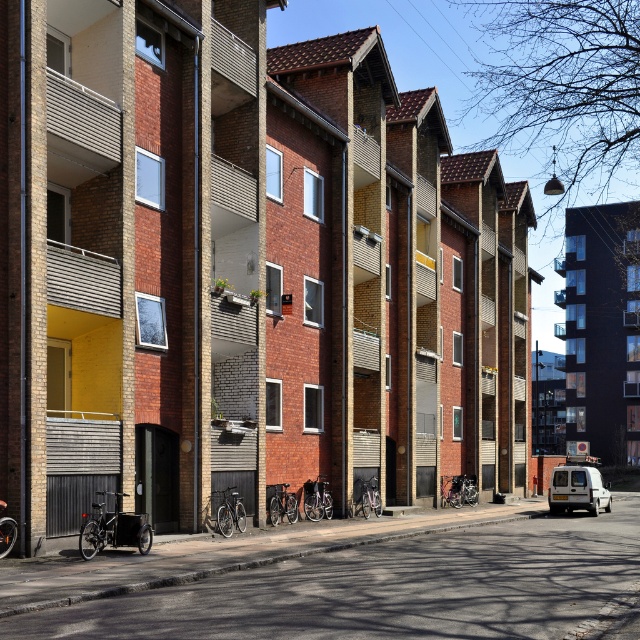
Question: Can you confirm if black metal bicycles at lower left is positioned to the left of white matte van at lower right?

Choices:
 (A) no
 (B) yes

Answer: (B)

Question: Which of the following is the farthest from the observer?

Choices:
 (A) black metal bicycles at lower left
 (B) white matte van at lower right

Answer: (B)

Question: Which point appears closest to the camera in this image?

Choices:
 (A) (426, 536)
 (B) (561, 486)

Answer: (A)

Question: Is black metal bicycles at lower left above white matte van at lower right?

Choices:
 (A) yes
 (B) no

Answer: (A)

Question: Does black metal bicycles at lower left have a lesser width compared to white matte van at lower right?

Choices:
 (A) yes
 (B) no

Answer: (B)